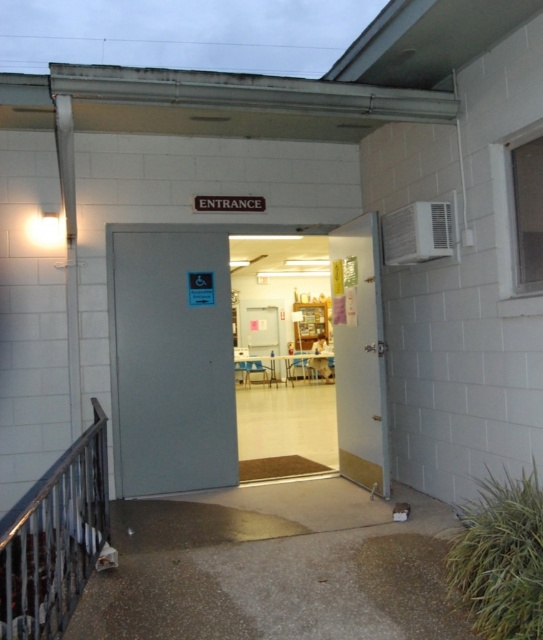
You are a delivery person trying to enter the building through the gray metallic door at center. The door is partially open, but there is a metallic gray balustrade at lower left blocking your path. Can you walk around the balustrade to reach the door?

The gray metallic door at center has a larger size compared to metallic gray balustrade at lower left, so yes, you can walk around the metallic gray balustrade at lower left to reach the gray metallic door at center since the door is bigger and the balustrade is smaller, allowing enough space to maneuver around it.

In the scene shown: You are standing at the entrance of the building and want to find the main door. According to the image, where is the gray metallic door at center located in terms of its 2D coordinates?

The gray metallic door at center is located at the 2D coordinates point (245,348).